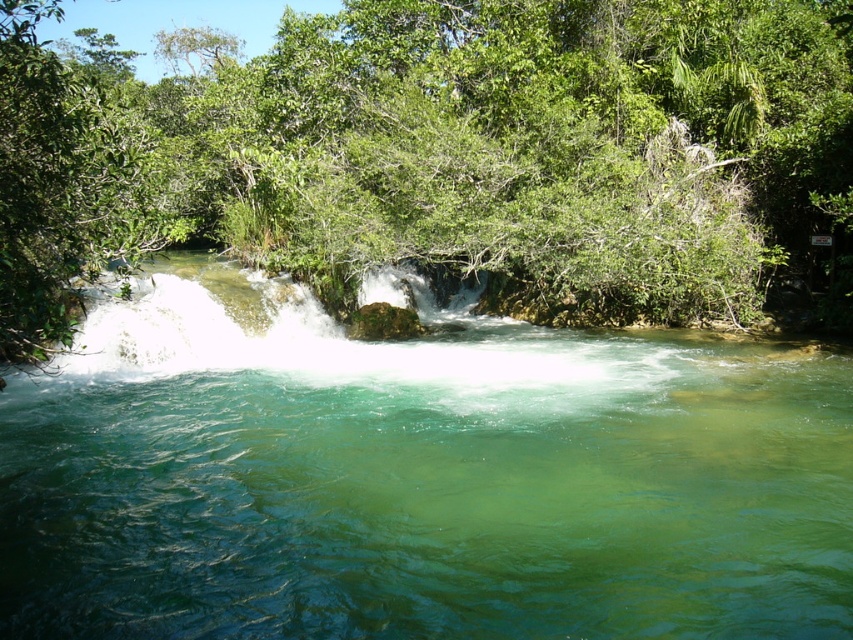
Question: Which of the following is the farthest from the observer?

Choices:
 (A) clear water at center
 (B) green leafy tree at upper center

Answer: (B)

Question: Is clear water at center bigger than green leafy tree at upper center?

Choices:
 (A) yes
 (B) no

Answer: (B)

Question: Where is clear water at center located in relation to green leafy tree at upper center in the image?

Choices:
 (A) below
 (B) above

Answer: (A)

Question: Is clear water at center thinner than green leafy tree at upper center?

Choices:
 (A) yes
 (B) no

Answer: (A)

Question: Which point appears closest to the camera in this image?

Choices:
 (A) (828, 284)
 (B) (166, 513)

Answer: (B)